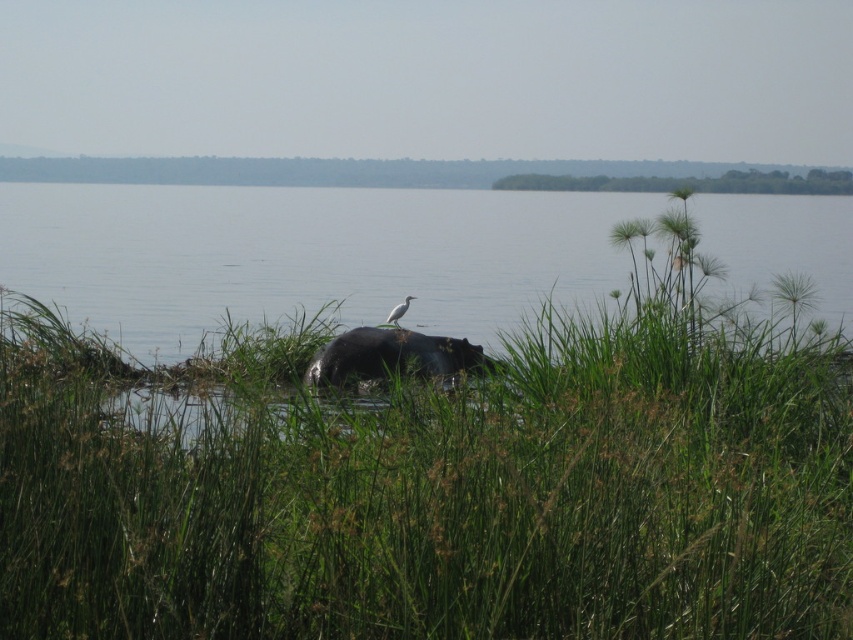
Question: Does green leafy grass at center have a smaller size compared to clear water at hippo center?

Choices:
 (A) yes
 (B) no

Answer: (A)

Question: Which point is farther to the camera?

Choices:
 (A) (45, 216)
 (B) (312, 381)
 (C) (608, 474)
 (D) (386, 324)

Answer: (A)

Question: Which point appears farthest from the camera in this image?

Choices:
 (A) (395, 317)
 (B) (355, 330)
 (C) (329, 248)
 (D) (592, 429)

Answer: (C)

Question: Is clear water at hippo center below dark brown fur hippo at center?

Choices:
 (A) yes
 (B) no

Answer: (B)

Question: Which is farther from the white matte bird at center?

Choices:
 (A) dark brown fur hippo at center
 (B) clear water at hippo center

Answer: (B)

Question: Is green leafy grass at center behind dark brown fur hippo at center?

Choices:
 (A) yes
 (B) no

Answer: (B)